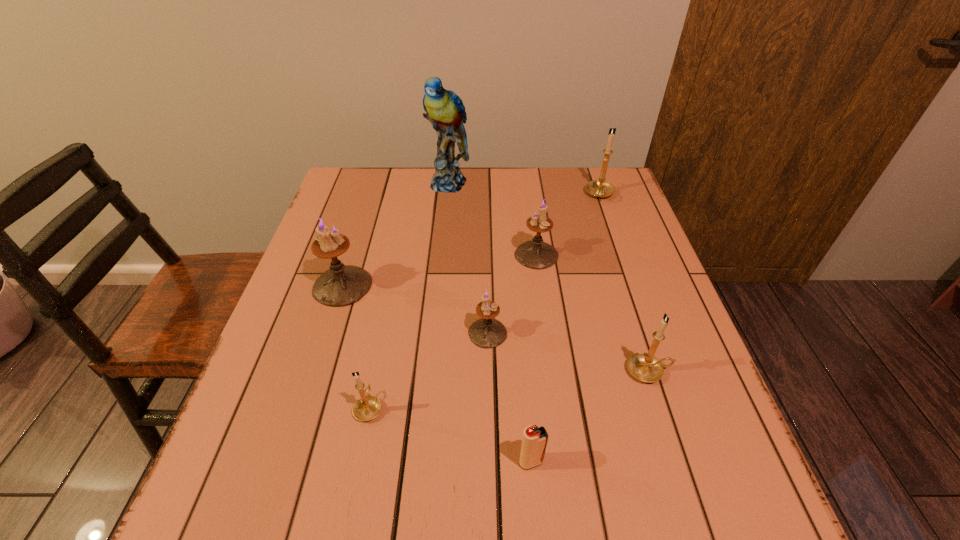
The height and width of the screenshot is (540, 960). I want to click on free space located 0.290m on the handle side of the second candle holder from left to right, so click(393, 286).

Image resolution: width=960 pixels, height=540 pixels. Identify the location of vacant space located on the handle side of the second candle holder from left to right. (387, 314).

Locate an element on the screen. vacant space situated on the handle side of the second candle holder from left to right is located at coordinates (389, 307).

In order to click on vacant space located on the back of the fifth object from right to left in this screenshot , I will do `click(486, 235)`.

Identify the location of free point located on the back of the nearest object. This screenshot has height=540, width=960. (527, 407).

This screenshot has width=960, height=540. Identify the location of parrot located at the far edge. (444, 109).

Where is `candle holder present at the far edge`? Image resolution: width=960 pixels, height=540 pixels. candle holder present at the far edge is located at coordinates (599, 188).

The height and width of the screenshot is (540, 960). In order to click on object that is positioned at the left edge in this screenshot , I will do `click(342, 285)`.

The image size is (960, 540). I want to click on object at the far right corner, so click(x=599, y=188).

In the image, there is a desktop. What are the coordinates of `vacant space at the far edge` in the screenshot? It's located at (419, 167).